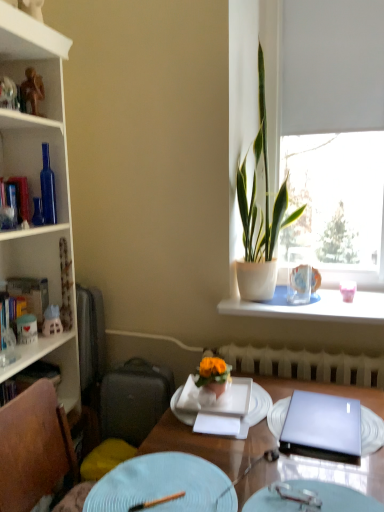
Where is `free space to the left of wooden chopstick at lower center, which appears as the 3th tableware when viewed from the right`? free space to the left of wooden chopstick at lower center, which appears as the 3th tableware when viewed from the right is located at coordinates (122, 496).